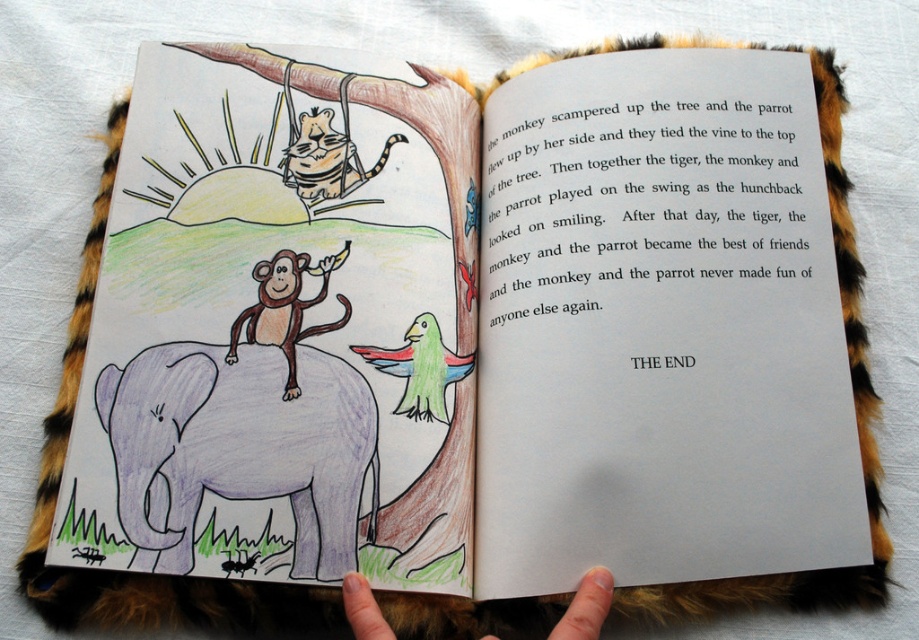
Is point (183, 502) positioned behind point (571, 637)?

Yes, it is.

Between purple pastel elephant at lower left and fur at lower center, which one appears on the left side from the viewer's perspective?

purple pastel elephant at lower left

Is point (291, 477) positioned behind point (586, 618)?

That is True.

Where is `purple pastel elephant at lower left`? purple pastel elephant at lower left is located at coordinates (237, 445).

Is purple pastel elephant at lower left bigger than smooth brown monkey at center?

Correct, purple pastel elephant at lower left is larger in size than smooth brown monkey at center.

Does purple pastel elephant at lower left have a smaller size compared to smooth brown monkey at center?

Incorrect, purple pastel elephant at lower left is not smaller in size than smooth brown monkey at center.

Which is in front, point (269, 403) or point (286, 358)?

Point (269, 403) is more forward.

Where is `purple pastel elephant at lower left`? The width and height of the screenshot is (919, 640). purple pastel elephant at lower left is located at coordinates (237, 445).

Measure the distance between smooth brown monkey at center and fur at lower center.

The distance of smooth brown monkey at center from fur at lower center is 26.30 centimeters.

Measure the distance between point [281,252] and camera.

Point [281,252] is 3.50 feet from camera.

Image resolution: width=919 pixels, height=640 pixels. What do you see at coordinates (285, 307) in the screenshot?
I see `smooth brown monkey at center` at bounding box center [285, 307].

Locate an element on the screen. The height and width of the screenshot is (640, 919). smooth brown monkey at center is located at coordinates (285, 307).